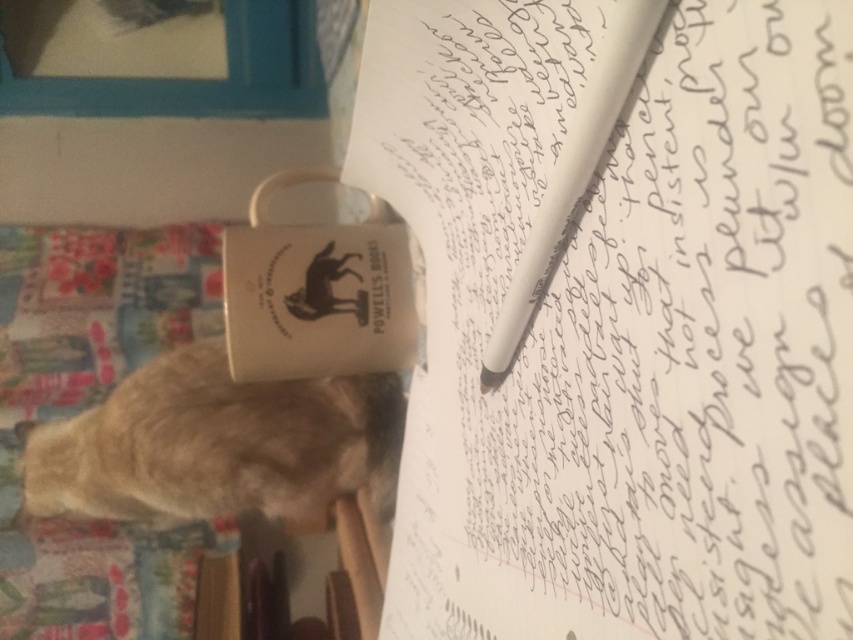
You are organizing a desk and need to place the white paper at upper center and the white matte pen at center. If you want to arrange them side by side horizontally, which one should be placed first to the left to ensure they fit within the desk space?

The white paper at upper center should be placed first to the left since it is wider than the white matte pen at center, allowing both to fit side by side without overlapping.

You are organizing a desk and need to place a new item between the white paper at upper center and the white matte pen at center. Based on their positions, where should you place the new item to ensure it is between them?

The new item should be placed to the right of the white paper at upper center and to the left of the white matte pen at center since the white paper at upper center is to the left of the white matte pen at center.